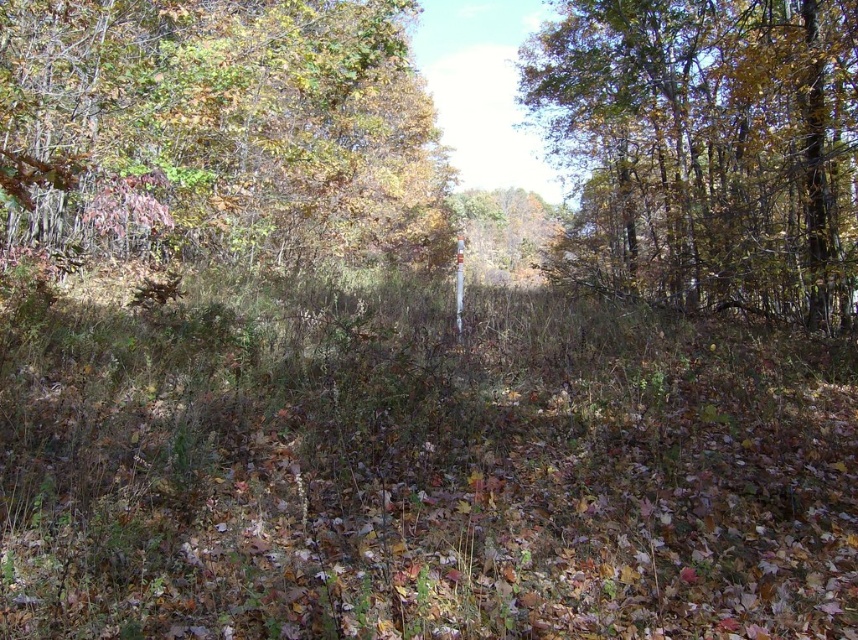
Based on the photo, does green leafy tree at upper left have a greater height compared to green leafy tree at upper right?

No.

Looking at this image, does green leafy tree at upper left lie behind green leafy tree at upper right?

No, it is not.

The height and width of the screenshot is (640, 858). Find the location of `green leafy tree at upper left`. green leafy tree at upper left is located at coordinates (221, 129).

Find the location of a particular element. The width and height of the screenshot is (858, 640). green leafy tree at upper left is located at coordinates (221, 129).